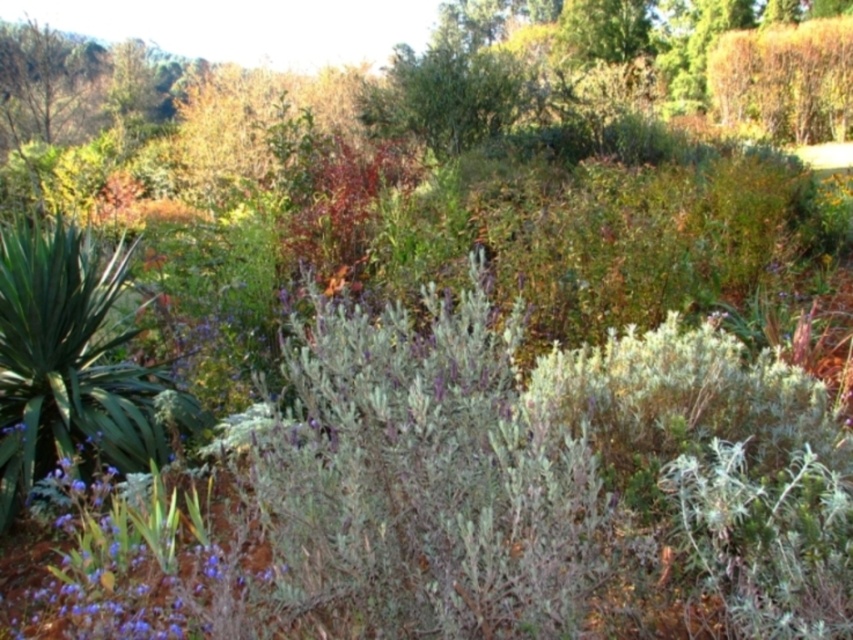
You are a gardener who wants to plant a new flower that needs at least 1 meter of space to grow. You see the green leafy plant at left and the purple matte flower at lower left in the garden. Which plant should you consider for spacing the new flower appropriately?

The green leafy plant at left has a greater height compared to the purple matte flower at lower left, so you should consider spacing the new flower around the green leafy plant at left to ensure enough vertical space for growth.